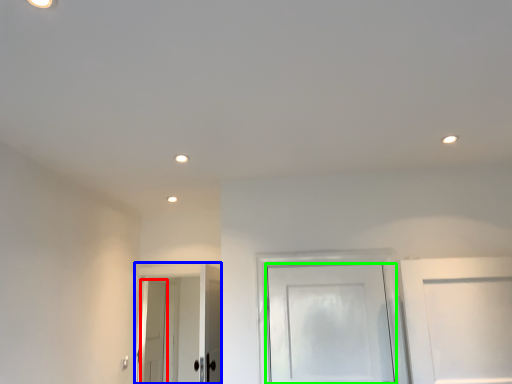
Question: Which object is positioned farthest from door (highlighted by a red box)? Select from door (highlighted by a blue box) and door (highlighted by a green box).

Choices:
 (A) door
 (B) door

Answer: (B)